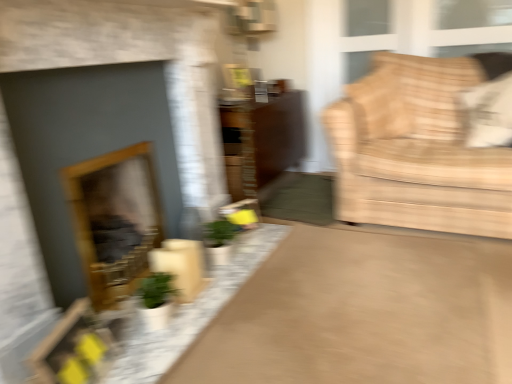
Question: Considering the relative positions of matte gray fireplace at left, marked as the 2th fireplace in a back-to-front arrangement, and white fabric pillow at upper right in the image provided, is matte gray fireplace at left, marked as the 2th fireplace in a back-to-front arrangement, to the right of white fabric pillow at upper right from the viewer's perspective?

Choices:
 (A) yes
 (B) no

Answer: (B)

Question: From a real-world perspective, is matte gray fireplace at left, the first fireplace from the front, on top of white fabric pillow at upper right?

Choices:
 (A) no
 (B) yes

Answer: (A)

Question: From a real-world perspective, is matte gray fireplace at left, marked as the 2th fireplace in a back-to-front arrangement, beneath white fabric pillow at upper right?

Choices:
 (A) yes
 (B) no

Answer: (A)

Question: Is matte gray fireplace at left, marked as the 2th fireplace in a back-to-front arrangement, further to the viewer compared to white fabric pillow at upper right?

Choices:
 (A) no
 (B) yes

Answer: (A)

Question: Can you confirm if matte gray fireplace at left, marked as the 2th fireplace in a back-to-front arrangement, is thinner than white fabric pillow at upper right?

Choices:
 (A) yes
 (B) no

Answer: (A)

Question: Is point (376, 61) positioned closer to the camera than point (238, 69)?

Choices:
 (A) closer
 (B) farther

Answer: (A)

Question: Looking at the image, does beige fabric couch at right seem bigger or smaller compared to metallic silver picture frame at upper center?

Choices:
 (A) big
 (B) small

Answer: (A)

Question: Would you say beige fabric couch at right is to the left or to the right of metallic silver picture frame at upper center in the picture?

Choices:
 (A) right
 (B) left

Answer: (A)

Question: Choose the correct answer: Is beige fabric couch at right inside metallic silver picture frame at upper center or outside it?

Choices:
 (A) inside
 (B) outside

Answer: (B)

Question: From the image's perspective, is matte brown rug at center positioned above or below white fabric pillow at upper right?

Choices:
 (A) above
 (B) below

Answer: (B)

Question: Considering the positions of matte brown rug at center and white fabric pillow at upper right in the image, is matte brown rug at center wider or thinner than white fabric pillow at upper right?

Choices:
 (A) thin
 (B) wide

Answer: (B)

Question: From a real-world perspective, is matte brown rug at center physically located above or below white fabric pillow at upper right?

Choices:
 (A) above
 (B) below

Answer: (B)

Question: Considering the relative positions of matte brown rug at center and white fabric pillow at upper right in the image provided, is matte brown rug at center to the left or to the right of white fabric pillow at upper right?

Choices:
 (A) right
 (B) left

Answer: (B)

Question: Is beige fabric couch at right taller or shorter than matte gray fireplace at left, the first fireplace from the front?

Choices:
 (A) short
 (B) tall

Answer: (A)

Question: Is beige fabric couch at right in front of or behind matte gray fireplace at left, the first fireplace from the front, in the image?

Choices:
 (A) front
 (B) behind

Answer: (B)